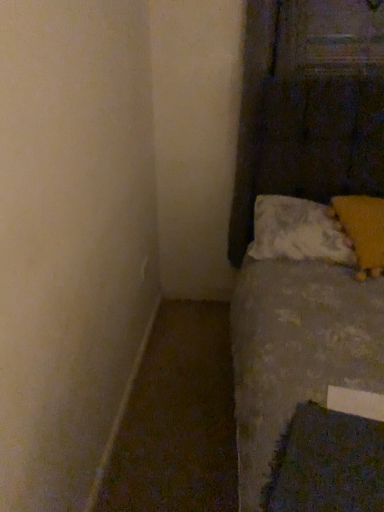
Question: Is dark blue textured sheet at lower right to the left or to the right of white soft pillow at lower right, positioned as the first pillow in left-to-right order, in the image?

Choices:
 (A) left
 (B) right

Answer: (A)

Question: Is dark blue textured sheet at lower right wider or thinner than white soft pillow at lower right, positioned as the first pillow in left-to-right order?

Choices:
 (A) thin
 (B) wide

Answer: (A)

Question: Which of these objects is positioned closest to the white soft pillow at lower right, positioned as the first pillow in left-to-right order?

Choices:
 (A) dark blue textured sheet at lower right
 (B) yellow fuzzy pillow at upper right, positioned as the first pillow in right-to-left order

Answer: (B)

Question: Which object is the closest to the white soft pillow at lower right, positioned as the first pillow in left-to-right order?

Choices:
 (A) dark blue textured sheet at lower right
 (B) yellow fuzzy pillow at upper right, positioned as the first pillow in right-to-left order

Answer: (B)